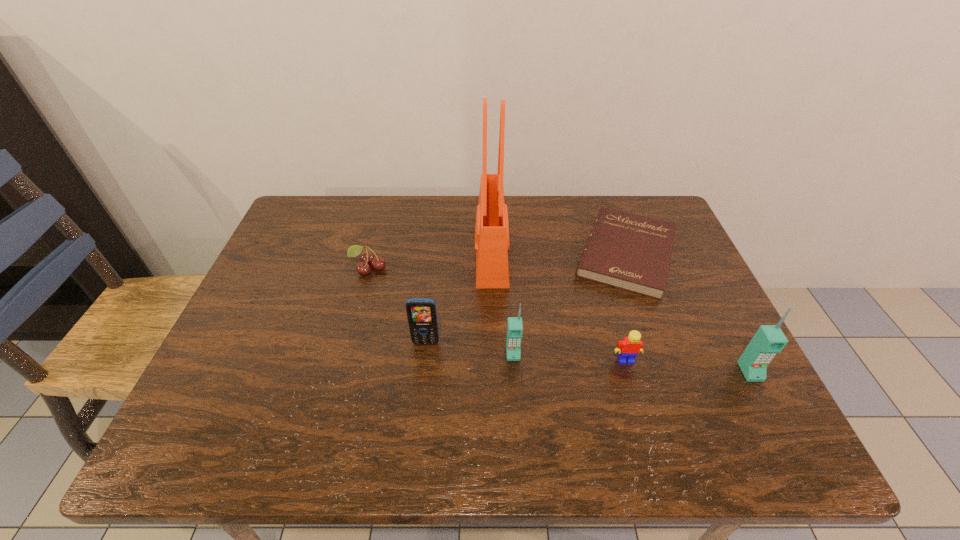
The width and height of the screenshot is (960, 540). In order to click on free spot located on the left of the hardback book in this screenshot , I will do pyautogui.click(x=510, y=254).

Where is `free space located 0.270m on the leaves of the leftmost object`? The image size is (960, 540). free space located 0.270m on the leaves of the leftmost object is located at coordinates (344, 363).

Where is `vacant space located 0.330m on the logo side of the tote bag`? This screenshot has height=540, width=960. vacant space located 0.330m on the logo side of the tote bag is located at coordinates 358,254.

Identify the location of free spot located on the logo side of the tote bag. This screenshot has height=540, width=960. (383, 254).

Where is `free location located 0.120m on the logo side of the tote bag`? The height and width of the screenshot is (540, 960). free location located 0.120m on the logo side of the tote bag is located at coordinates coord(432,254).

You are a GUI agent. You are given a task and a screenshot of the screen. Output one action in this format:
    pyautogui.click(x=<x>, y=<y>)
    Task: Click on the vacant region located 0.110m on the front-facing side of the Lego
    Image resolution: width=960 pixels, height=540 pixels.
    Given the screenshot: What is the action you would take?
    pyautogui.click(x=639, y=410)

Image resolution: width=960 pixels, height=540 pixels. I want to click on free region located on the screen of the second object from left to right, so click(421, 384).

The height and width of the screenshot is (540, 960). In order to click on hardback book that is at the far edge in this screenshot , I will do click(x=631, y=252).

Where is `tote bag that is at the far edge`? tote bag that is at the far edge is located at coordinates (492, 244).

At what (x,y) coordinates should I click in order to perform the action: click on object situated at the near edge. Please return your answer as a coordinate pair (x, y). Looking at the image, I should click on (769, 339).